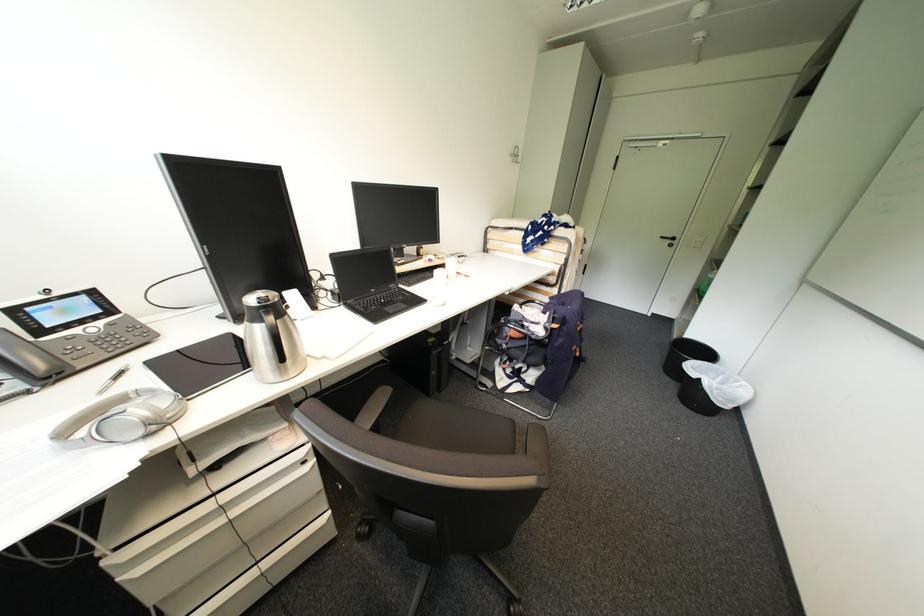
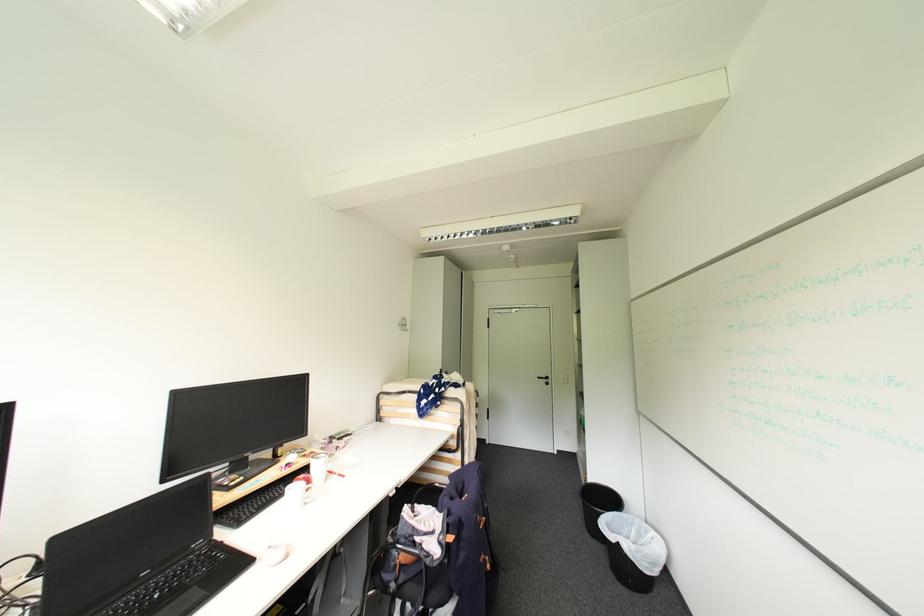
The point at (553, 325) is marked in the first image. Where is the corresponding point in the second image?

(447, 538)